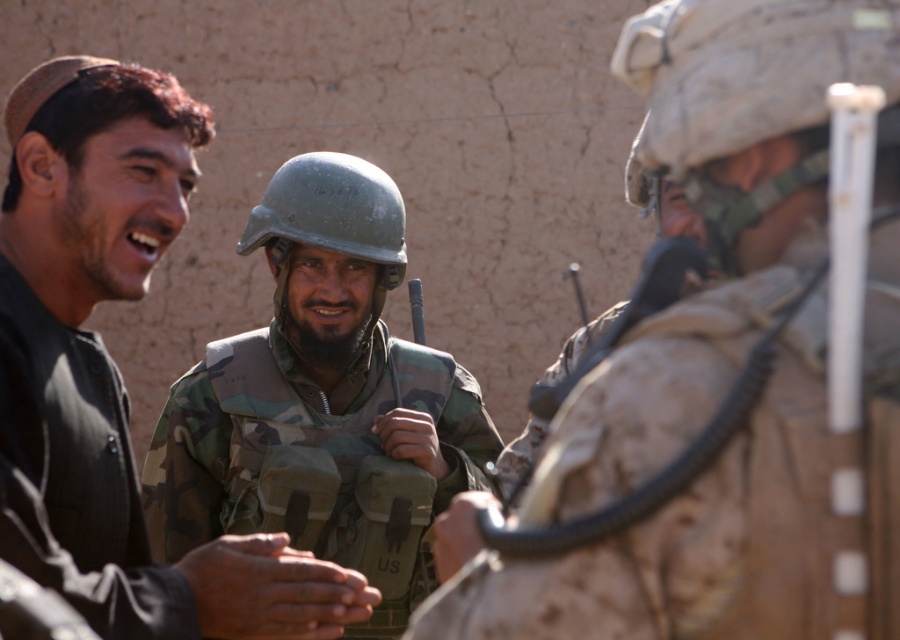
Is camouflage fabric helmet at center above camo fabric vest at center?

Correct, camouflage fabric helmet at center is located above camo fabric vest at center.

Is point (648, 536) farther from viewer compared to point (384, 525)?

No, (648, 536) is closer to viewer.

Who is more forward, (708,612) or (417,481)?

Point (708,612)

Image resolution: width=900 pixels, height=640 pixels. In order to click on camouflage fabric helmet at center in this screenshot , I will do `click(717, 218)`.

Which is behind, point (392, 216) or point (736, 42)?

The point (392, 216) is more distant.

Who is more forward, (370, 566) or (721, 140)?

Positioned in front is point (721, 140).

The width and height of the screenshot is (900, 640). Describe the element at coordinates (321, 401) in the screenshot. I see `camo fabric vest at center` at that location.

This screenshot has height=640, width=900. In order to click on camo fabric vest at center in this screenshot , I will do `click(321, 401)`.

Is camouflage fabric helmet at center further to the viewer compared to camouflage fabric helmet at upper right?

No.

Is camouflage fabric helmet at center positioned in front of camouflage fabric helmet at upper right?

That is True.

Between point (742, 164) and point (770, 8), which one is positioned in front?

Point (770, 8) is in front.

Where is `camouflage fabric helmet at center`? camouflage fabric helmet at center is located at coordinates (717, 218).